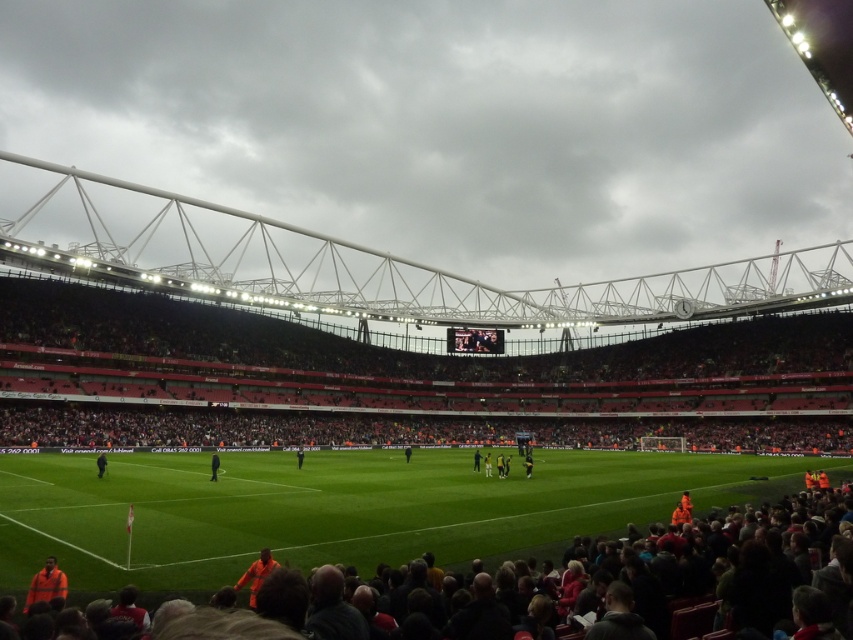
Who is taller, orange jacket at center or black jersey at center?

With more height is black jersey at center.

Between orange jacket at center and black jersey at center, which one appears on the left side from the viewer's perspective?

orange jacket at center is more to the left.

Is point (213, 470) in front of point (527, 461)?

Yes.

Where is `orange jacket at center`? orange jacket at center is located at coordinates (213, 465).

Which is in front, point (233, 586) or point (503, 476)?

Point (233, 586)

Looking at this image, how much distance is there between orange fabric jacket at lower center and yellow jersey at center?

The distance of orange fabric jacket at lower center from yellow jersey at center is 54.94 meters.

Where is `orange fabric jacket at lower center`? This screenshot has width=853, height=640. orange fabric jacket at lower center is located at coordinates (256, 573).

Describe the element at coordinates (45, 582) in the screenshot. This screenshot has width=853, height=640. I see `high-visibility orange jacket at lower left` at that location.

Find the location of `high-visibility orange jacket at lower left`. high-visibility orange jacket at lower left is located at coordinates (45, 582).